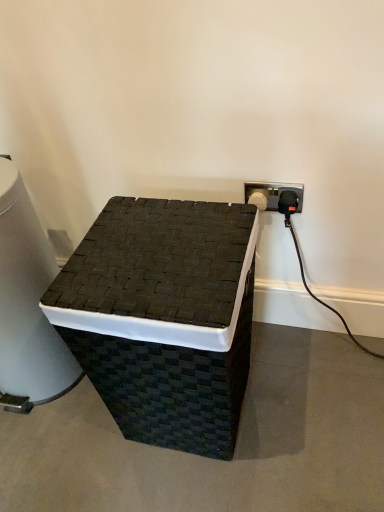
Question: From the image's perspective, is black woven basket at center above or below black woven water cooler at left?

Choices:
 (A) above
 (B) below

Answer: (B)

Question: Which is correct: black woven basket at center is inside black woven water cooler at left, or outside of it?

Choices:
 (A) inside
 (B) outside

Answer: (B)

Question: From their relative heights in the image, would you say black woven basket at center is taller or shorter than black woven water cooler at left?

Choices:
 (A) short
 (B) tall

Answer: (A)

Question: Is black woven water cooler at left taller or shorter than black woven basket at center?

Choices:
 (A) short
 (B) tall

Answer: (B)

Question: In terms of size, does black woven water cooler at left appear bigger or smaller than black woven basket at center?

Choices:
 (A) small
 (B) big

Answer: (A)

Question: Is black woven water cooler at left wider or thinner than black woven basket at center?

Choices:
 (A) wide
 (B) thin

Answer: (B)

Question: Considering their positions, is black woven water cooler at left located in front of or behind black woven basket at center?

Choices:
 (A) front
 (B) behind

Answer: (B)